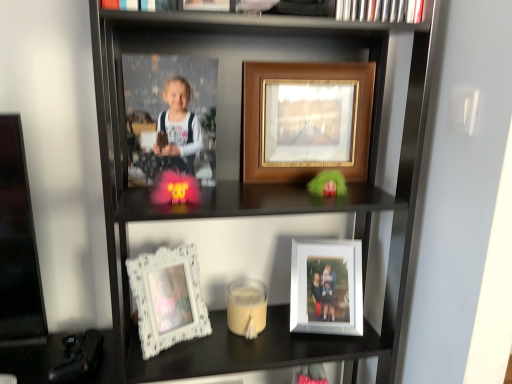
Question: From the image's perspective, is white ornate frame at lower left, the 3th picture frame when ordered from right to left, over white matte candle at center?

Choices:
 (A) yes
 (B) no

Answer: (A)

Question: Is white matte candle at center surrounded by white ornate frame at lower left, which is the 3th picture frame from top to bottom?

Choices:
 (A) yes
 (B) no

Answer: (B)

Question: Considering the relative positions of white ornate frame at lower left, which is the 3th picture frame from top to bottom, and white matte candle at center in the image provided, is white ornate frame at lower left, which is the 3th picture frame from top to bottom, behind white matte candle at center?

Choices:
 (A) no
 (B) yes

Answer: (A)

Question: Can you confirm if white ornate frame at lower left, the first picture frame in the left-to-right sequence, is thinner than white matte candle at center?

Choices:
 (A) yes
 (B) no

Answer: (A)

Question: Is white ornate frame at lower left, the 3th picture frame when ordered from right to left, bigger than white matte candle at center?

Choices:
 (A) no
 (B) yes

Answer: (B)

Question: From a real-world perspective, is white ornate frame at lower left, which is the first picture frame from bottom to top, physically above white matte candle at center?

Choices:
 (A) no
 (B) yes

Answer: (B)

Question: Can you confirm if white matte candle at center is positioned to the right of wooden framed photo at center, placed as the 1th picture frame when sorted from top to bottom?

Choices:
 (A) no
 (B) yes

Answer: (A)

Question: Does white matte candle at center come behind wooden framed photo at center, placed as the 1th picture frame when sorted from top to bottom?

Choices:
 (A) no
 (B) yes

Answer: (B)

Question: From the image's perspective, does white matte candle at center appear higher than wooden framed photo at center, the 2th picture frame when ordered from right to left?

Choices:
 (A) yes
 (B) no

Answer: (B)

Question: Can you confirm if white matte candle at center is taller than wooden framed photo at center, the 2th picture frame when ordered from right to left?

Choices:
 (A) yes
 (B) no

Answer: (B)

Question: Is white matte candle at center completely or partially outside of wooden framed photo at center, the 2th picture frame when ordered from right to left?

Choices:
 (A) no
 (B) yes

Answer: (B)

Question: Is white matte candle at center closer to the viewer compared to wooden framed photo at center, marked as the second picture frame in a left-to-right arrangement?

Choices:
 (A) yes
 (B) no

Answer: (B)

Question: Is the position of white ornate frame at lower left, the first picture frame in the left-to-right sequence, less distant than that of wooden framed photo at center, marked as the third picture frame in a bottom-to-top arrangement?

Choices:
 (A) yes
 (B) no

Answer: (A)